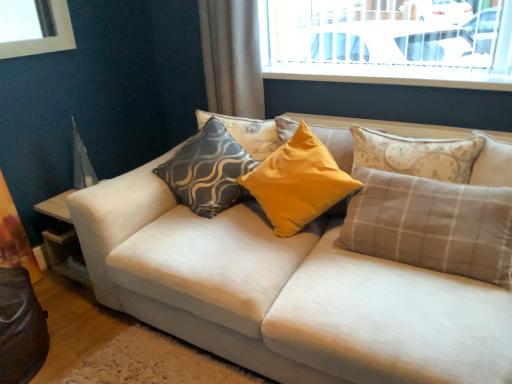
Question: From a real-world perspective, is yellow fabric curtain at left, the 1th curtain in the bottom-to-top sequence, under gray plaid pillow at right, which is the first pillow in right-to-left order?

Choices:
 (A) no
 (B) yes

Answer: (B)

Question: Can you confirm if yellow fabric curtain at left, marked as the 2th curtain in a top-to-bottom arrangement, is wider than gray plaid pillow at right, which is the first pillow in right-to-left order?

Choices:
 (A) yes
 (B) no

Answer: (B)

Question: Is the depth of yellow fabric curtain at left, marked as the 2th curtain in a top-to-bottom arrangement, less than that of gray plaid pillow at right, which is the first pillow in right-to-left order?

Choices:
 (A) yes
 (B) no

Answer: (B)

Question: From the image's perspective, is yellow fabric curtain at left, marked as the 2th curtain in a top-to-bottom arrangement, below gray plaid pillow at right, which is the first pillow in right-to-left order?

Choices:
 (A) yes
 (B) no

Answer: (A)

Question: Is yellow fabric curtain at left, the 1th curtain in the bottom-to-top sequence, positioned behind gray plaid pillow at right, which is the first pillow in right-to-left order?

Choices:
 (A) no
 (B) yes

Answer: (B)

Question: Can you confirm if yellow fabric curtain at left, the 1th curtain in the bottom-to-top sequence, is taller than gray plaid pillow at right, which is the first pillow in right-to-left order?

Choices:
 (A) yes
 (B) no

Answer: (A)

Question: From a real-world perspective, is matte gray-patterned pillow at center, arranged as the 4th pillow when viewed from the right, on plaid fabric pillow at center, which is the 4th pillow in left-to-right order?

Choices:
 (A) no
 (B) yes

Answer: (B)

Question: From a real-world perspective, is matte gray-patterned pillow at center, arranged as the 4th pillow when viewed from the right, beneath plaid fabric pillow at center, which is the 4th pillow in left-to-right order?

Choices:
 (A) no
 (B) yes

Answer: (A)

Question: Can you confirm if matte gray-patterned pillow at center, arranged as the 4th pillow when viewed from the right, is smaller than plaid fabric pillow at center, marked as the 2th pillow in a right-to-left arrangement?

Choices:
 (A) no
 (B) yes

Answer: (B)

Question: Is matte gray-patterned pillow at center, which is the 2th pillow from left to right, further to camera compared to plaid fabric pillow at center, which is the 4th pillow in left-to-right order?

Choices:
 (A) yes
 (B) no

Answer: (A)

Question: Considering the relative positions of matte gray-patterned pillow at center, arranged as the 4th pillow when viewed from the right, and plaid fabric pillow at center, which is the 4th pillow in left-to-right order, in the image provided, is matte gray-patterned pillow at center, arranged as the 4th pillow when viewed from the right, in front of plaid fabric pillow at center, which is the 4th pillow in left-to-right order,?

Choices:
 (A) yes
 (B) no

Answer: (B)

Question: Is matte gray-patterned pillow at center, arranged as the 4th pillow when viewed from the right, aimed at plaid fabric pillow at center, which is the 4th pillow in left-to-right order?

Choices:
 (A) no
 (B) yes

Answer: (A)

Question: From a real-world perspective, is plaid fabric pillow at center, marked as the 2th pillow in a right-to-left arrangement, located beneath white fabric couch at center?

Choices:
 (A) no
 (B) yes

Answer: (A)